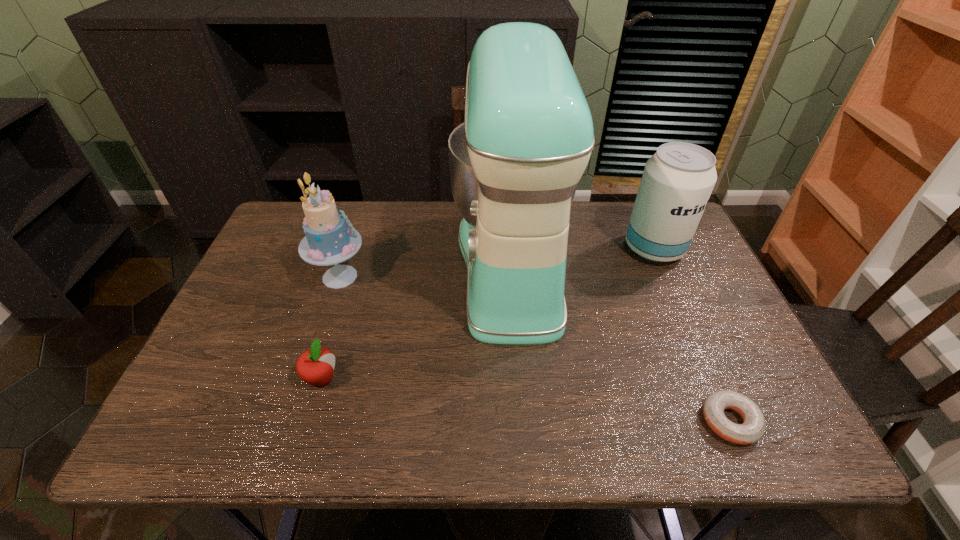
Identify the location of vacant space that satisfies the following two spatial constraints: 1. on the front side of the alcohol; 2. at the base of the mixer. The image size is (960, 540). (661, 265).

You are a GUI agent. You are given a task and a screenshot of the screen. Output one action in this format:
    pyautogui.click(x=<x>, y=<y>)
    Task: Click on the vacant space that satisfies the following two spatial constraints: 1. on the front side of the alcohol; 2. with a ladder on the side of the cake
    
    Given the screenshot: What is the action you would take?
    pyautogui.click(x=666, y=276)

At what (x,y) coordinates should I click in order to perform the action: click on vacant space that satisfies the following two spatial constraints: 1. at the base of the nearest object; 2. on the left side of the tallest object. Please return your answer as a coordinate pair (x, y). This screenshot has width=960, height=540. Looking at the image, I should click on (524, 421).

Find the location of a particular element. vacant space that satisfies the following two spatial constraints: 1. with a ladder on the side of the second nearest object; 2. on the left side of the cake is located at coordinates (306, 378).